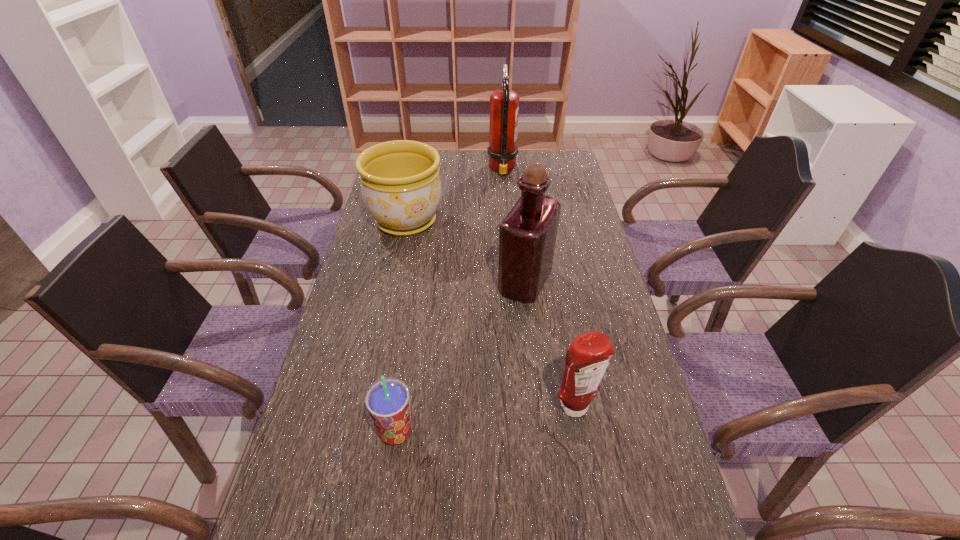
Identify the location of fire extinguisher. The height and width of the screenshot is (540, 960). (504, 104).

Image resolution: width=960 pixels, height=540 pixels. I want to click on liquor, so click(527, 236).

This screenshot has height=540, width=960. In order to click on flowerpot in this screenshot , I will do `click(401, 187)`.

Image resolution: width=960 pixels, height=540 pixels. In order to click on condiment in this screenshot , I will do `click(589, 354)`.

You are a GUI agent. You are given a task and a screenshot of the screen. Output one action in this format:
    pyautogui.click(x=<x>, y=<y>)
    Task: Click on the smoothie
    
    Given the screenshot: What is the action you would take?
    pyautogui.click(x=387, y=400)

The height and width of the screenshot is (540, 960). What are the coordinates of `blank area located at the nozzle of the farthest object` in the screenshot? It's located at (402, 170).

Image resolution: width=960 pixels, height=540 pixels. I want to click on free space located at the nozzle of the farthest object, so click(x=456, y=170).

Locate an element on the screen. vacant space located 0.330m at the nozzle of the farthest object is located at coordinates (407, 170).

This screenshot has height=540, width=960. I want to click on blank space located on the right of the third nearest object, so click(573, 282).

Image resolution: width=960 pixels, height=540 pixels. What are the coordinates of `vacant space located 0.240m on the right of the flowerpot` in the screenshot? It's located at (512, 221).